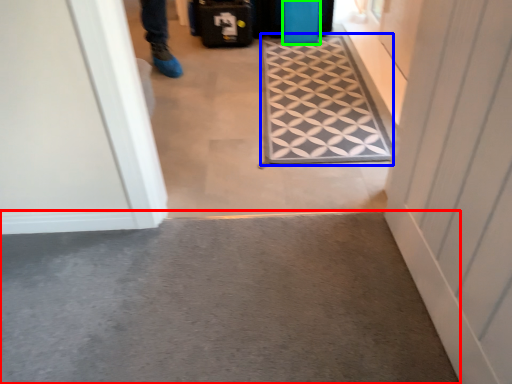
Question: Which object is positioned farthest from concrete (highlighted by a red box)? Select from doormat (highlighted by a blue box) and luggage (highlighted by a green box).

Choices:
 (A) doormat
 (B) luggage

Answer: (B)